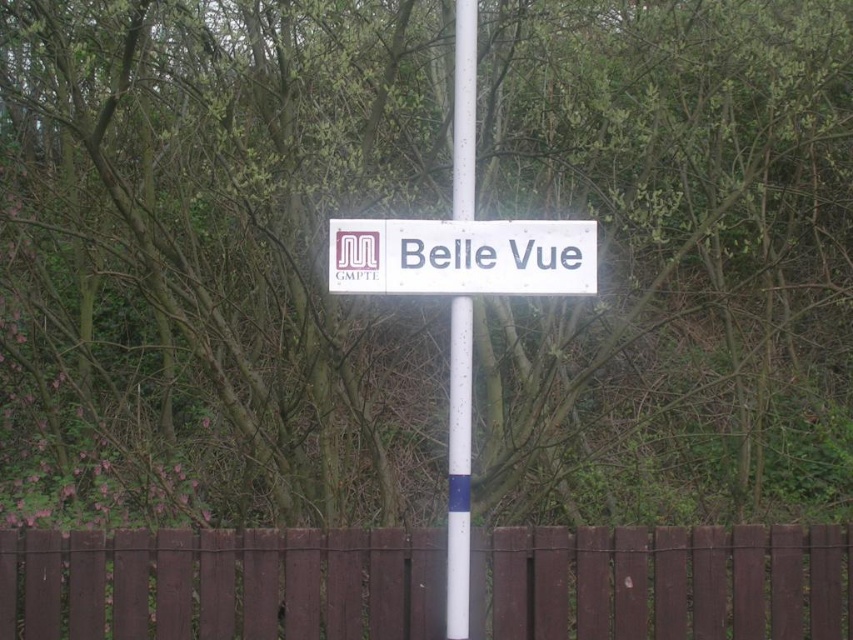
Question: Observing the image, what is the correct spatial positioning of brown wooden fence at center in reference to white plastic sign at center?

Choices:
 (A) left
 (B) right

Answer: (A)

Question: Which point is farther to the camera?

Choices:
 (A) white plastic pole at center
 (B) white plastic sign at center
 (C) brown wooden fence at center

Answer: (C)

Question: Observing the image, what is the correct spatial positioning of white plastic sign at center in reference to white plastic pole at center?

Choices:
 (A) below
 (B) above

Answer: (B)

Question: Which of the following is the closest to the observer?

Choices:
 (A) (476, 561)
 (B) (459, 218)

Answer: (B)

Question: Considering the real-world distances, which object is farthest from the white plastic pole at center?

Choices:
 (A) brown wooden fence at center
 (B) white plastic sign at center

Answer: (A)

Question: Is brown wooden fence at center further to camera compared to white plastic pole at center?

Choices:
 (A) yes
 (B) no

Answer: (A)